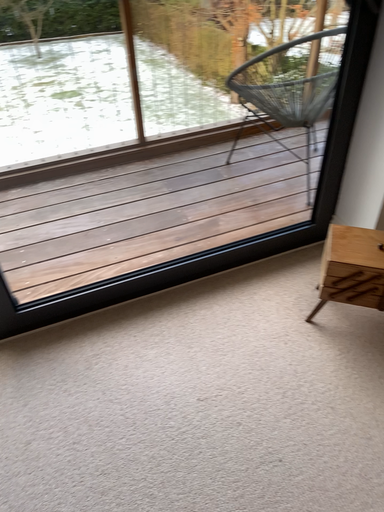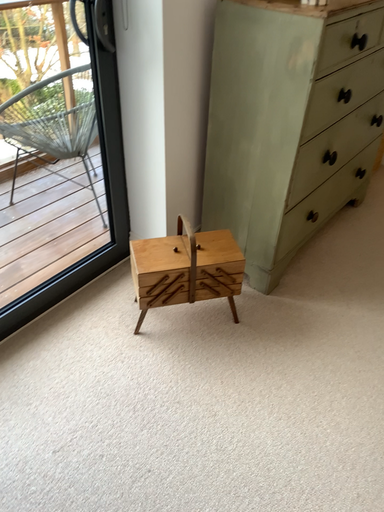
Question: Which way did the camera rotate in the video?

Choices:
 (A) rotated upward
 (B) rotated downward

Answer: (A)